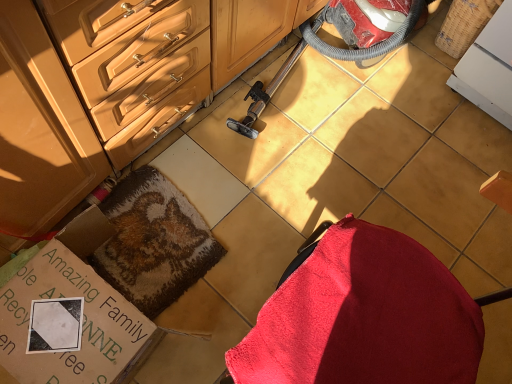
Find the location of a particular element. empty space that is ontop of cardboard box at lower left (from a real-world perspective) is located at coordinates (70, 322).